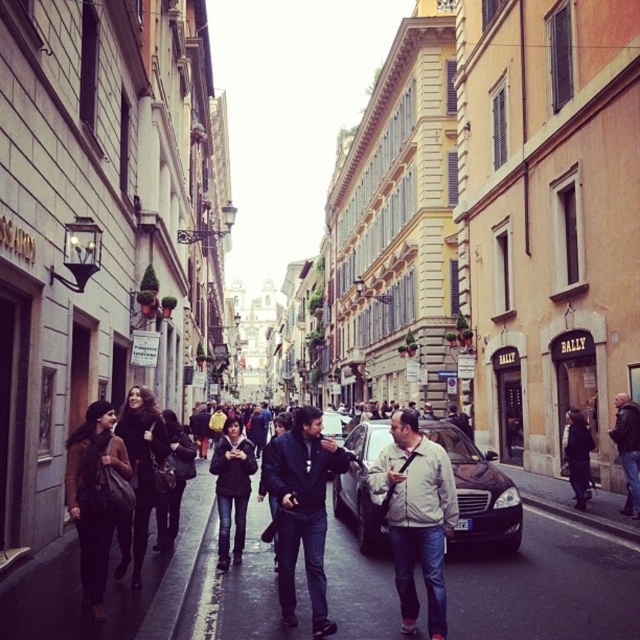
Question: Does light beige jacket at center appear over denim jacket at center?

Choices:
 (A) yes
 (B) no

Answer: (B)

Question: Does denim jacket at center have a lesser width compared to dark brown leather coat at center?

Choices:
 (A) no
 (B) yes

Answer: (B)

Question: Which point appears closest to the camera in this image?

Choices:
 (A) (378, 429)
 (B) (476, 632)
 (C) (586, 472)
 (D) (324, 628)

Answer: (B)

Question: Considering the real-world distances, which object is farthest from the shiny black car at center?

Choices:
 (A) dark brown leather coat at center
 (B) dark gray jacket at right
 (C) brown leather jacket at lower left
 (D) dark gray coat at center

Answer: (C)

Question: Which object appears farthest from the camera in this image?

Choices:
 (A) brown leather jacket at lower left
 (B) dark gray jacket at right
 (C) shiny black car at center

Answer: (B)

Question: Is dark gray jacket at center to the right of dark gray coat at center from the viewer's perspective?

Choices:
 (A) no
 (B) yes

Answer: (A)